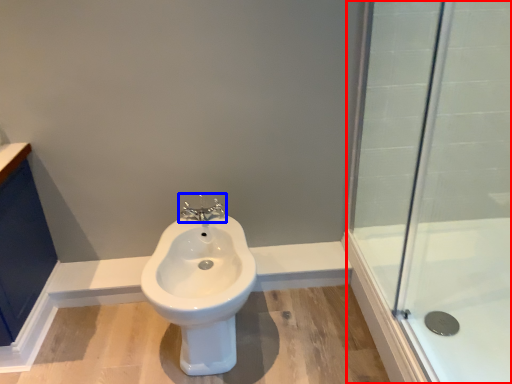
Question: Among these objects, which one is farthest to the camera, shower door (highlighted by a red box) or tap (highlighted by a blue box)?

Choices:
 (A) shower door
 (B) tap

Answer: (B)